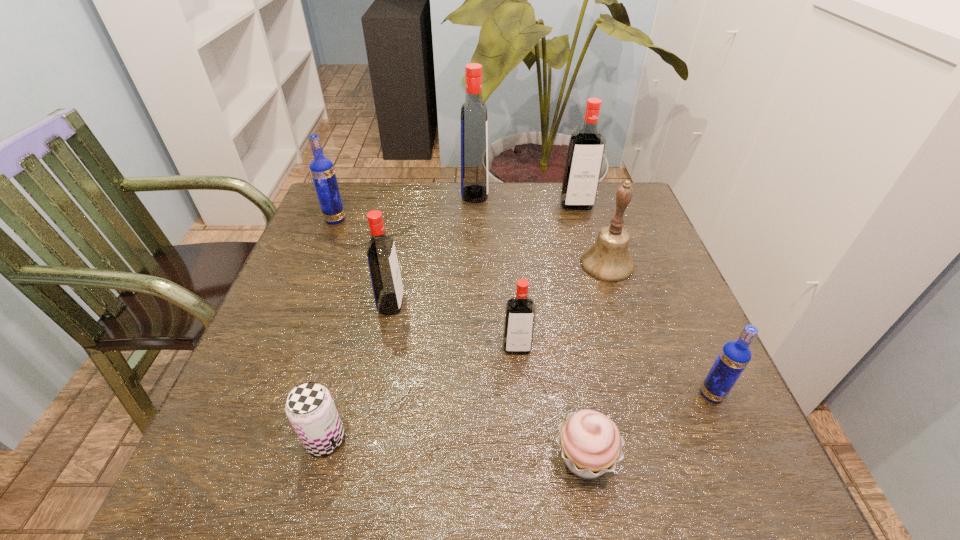
This screenshot has width=960, height=540. I want to click on the tallest object, so click(474, 128).

Locate an element on the screen. The height and width of the screenshot is (540, 960). the fourth object from left to right is located at coordinates (474, 128).

The image size is (960, 540). Find the location of `the rightmost red vodka`. the rightmost red vodka is located at coordinates (586, 148).

Where is `the second tallest object`? the second tallest object is located at coordinates (586, 148).

This screenshot has width=960, height=540. Find the location of `the farther blue vodka`. the farther blue vodka is located at coordinates (322, 171).

Where is `the leftmost object`? The width and height of the screenshot is (960, 540). the leftmost object is located at coordinates (322, 171).

This screenshot has height=540, width=960. In order to click on the fourth farthest vodka in this screenshot , I will do pos(387,285).

Locate an element on the screen. This screenshot has height=540, width=960. the second smallest red vodka is located at coordinates (387, 285).

The width and height of the screenshot is (960, 540). Find the location of `the sixth nearest object`. the sixth nearest object is located at coordinates (608, 260).

Locate an element on the screen. the right blue vodka is located at coordinates (734, 357).